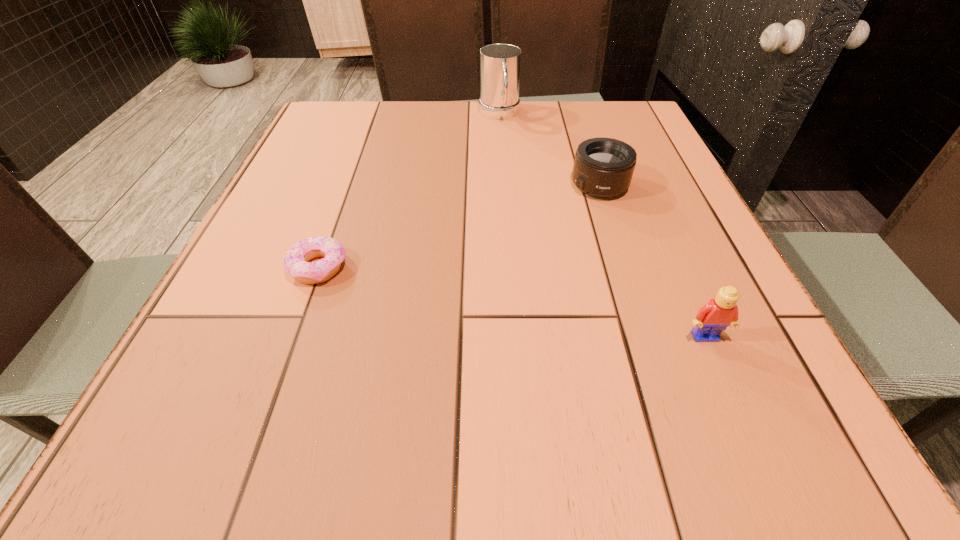
Locate an element on the screen. vacant area between the third shortest object and the doughnut is located at coordinates (512, 302).

Find the location of a particular element. The height and width of the screenshot is (540, 960). vacant space that is in between the telephoto lens and the third farthest object is located at coordinates (459, 226).

I want to click on free area in between the third farthest object and the second shortest object, so click(x=459, y=226).

Find the location of a particular element. The width and height of the screenshot is (960, 540). empty location between the telephoto lens and the nearest object is located at coordinates (652, 261).

Locate an element on the screen. This screenshot has height=540, width=960. vacant space that's between the mug and the Lego is located at coordinates (602, 225).

Point out which object is positioned as the second nearest to the doughnut. Please provide its 2D coordinates. Your answer should be formatted as a tuple, i.e. [(x, y)], where the tuple contains the x and y coordinates of a point satisfying the conditions above.

[(500, 64)]

Identify which object is located as the third nearest to the telephoto lens. Please provide its 2D coordinates. Your answer should be formatted as a tuple, i.e. [(x, y)], where the tuple contains the x and y coordinates of a point satisfying the conditions above.

[(295, 263)]

You are a GUI agent. You are given a task and a screenshot of the screen. Output one action in this format:
    pyautogui.click(x=<x>, y=<y>)
    Task: Click on the free location that satisfies the following two spatial constraints: 1. on the front side of the third object from right to left; 2. on the left side of the third tallest object
    The image size is (960, 540).
    Given the screenshot: What is the action you would take?
    pyautogui.click(x=504, y=185)